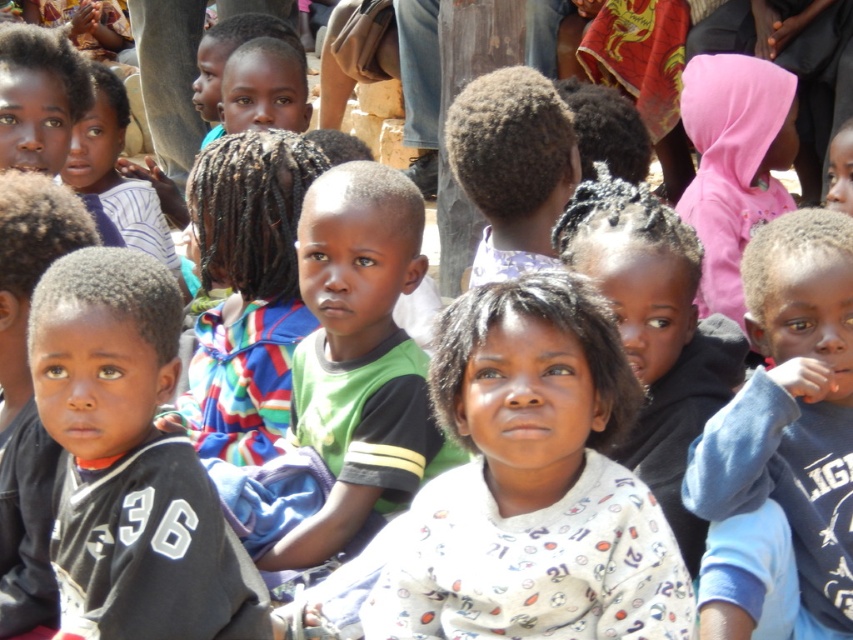
Question: Which point appears farthest from the camera in this image?

Choices:
 (A) (294, 397)
 (B) (811, 230)

Answer: (A)

Question: Can you confirm if black jersey at left is bigger than blue fleece jacket at right?

Choices:
 (A) yes
 (B) no

Answer: (A)

Question: Can you confirm if blue fleece jacket at right is positioned to the right of green jersey at center?

Choices:
 (A) yes
 (B) no

Answer: (A)

Question: Which of the following is the farthest from the observer?

Choices:
 (A) black jersey at left
 (B) green jersey at center

Answer: (B)

Question: Considering the relative positions of black jersey at left and blue fleece jacket at right in the image provided, where is black jersey at left located with respect to blue fleece jacket at right?

Choices:
 (A) left
 (B) right

Answer: (A)

Question: Among these objects, which one is nearest to the camera?

Choices:
 (A) black jersey at left
 (B) blue fleece jacket at right
 (C) green jersey at center

Answer: (B)